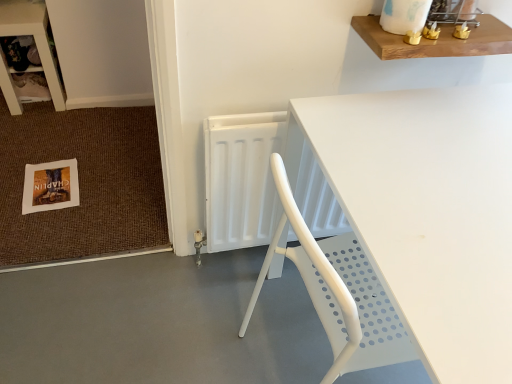
Question: From a real-world perspective, is white paper doormat at lower left above or below white paper postcard at lower left?

Choices:
 (A) above
 (B) below

Answer: (B)

Question: Would you say white paper doormat at lower left is to the left or to the right of white paper postcard at lower left in the picture?

Choices:
 (A) left
 (B) right

Answer: (A)

Question: Which object is the closest to the white paper doormat at lower left?

Choices:
 (A) white paper postcard at lower left
 (B) gray smooth concrete at lower left
 (C) wooden shelf at upper right
 (D) white plastic table at center
 (E) wooden shelf at upper left

Answer: (A)

Question: Which object is positioned farthest from the wooden shelf at upper right?

Choices:
 (A) white plastic table at center
 (B) white plastic radiator at center
 (C) white paper postcard at lower left
 (D) wooden shelf at upper left
 (E) gray smooth concrete at lower left

Answer: (D)